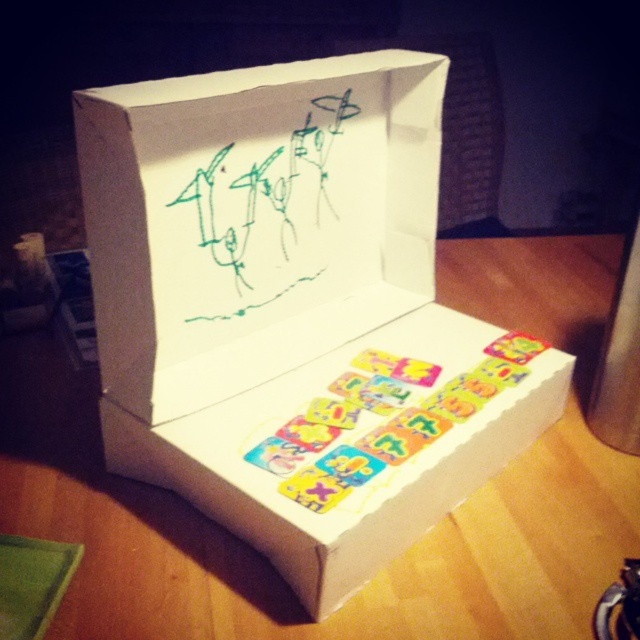
You are trying to determine if the green marker drawing at center can fit inside the white cardboard box at center. Based on their heights, can it fit vertically?

The white cardboard box at center has a greater height compared to the green marker drawing at center, so the drawing can fit vertically inside the box.

You are standing in a room and see a white cardboard box at center. What is the object located at point (294,310)?

The object located at point (294,310) is the white cardboard box at center.